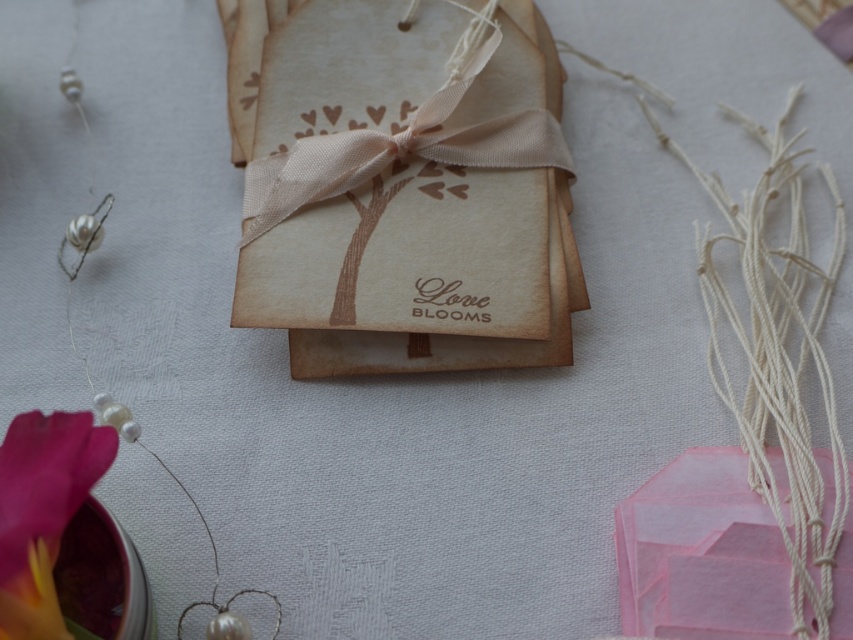
Question: Can you confirm if white string at upper right is smaller than transparent pink box at center?

Choices:
 (A) no
 (B) yes

Answer: (A)

Question: Which point is closer to the camera?

Choices:
 (A) matte brown paper bag at center
 (B) matte pink petal at lower left

Answer: (B)

Question: Does transparent pink box at center appear over matte pink petal at lower left?

Choices:
 (A) yes
 (B) no

Answer: (B)

Question: Which object appears farthest from the camera in this image?

Choices:
 (A) transparent pink box at center
 (B) matte brown paper bag at center
 (C) white string at upper right

Answer: (B)

Question: Among these objects, which one is nearest to the camera?

Choices:
 (A) white string at upper right
 (B) matte brown paper bag at center

Answer: (A)

Question: Is matte brown paper bag at center thinner than transparent pink box at center?

Choices:
 (A) no
 (B) yes

Answer: (A)